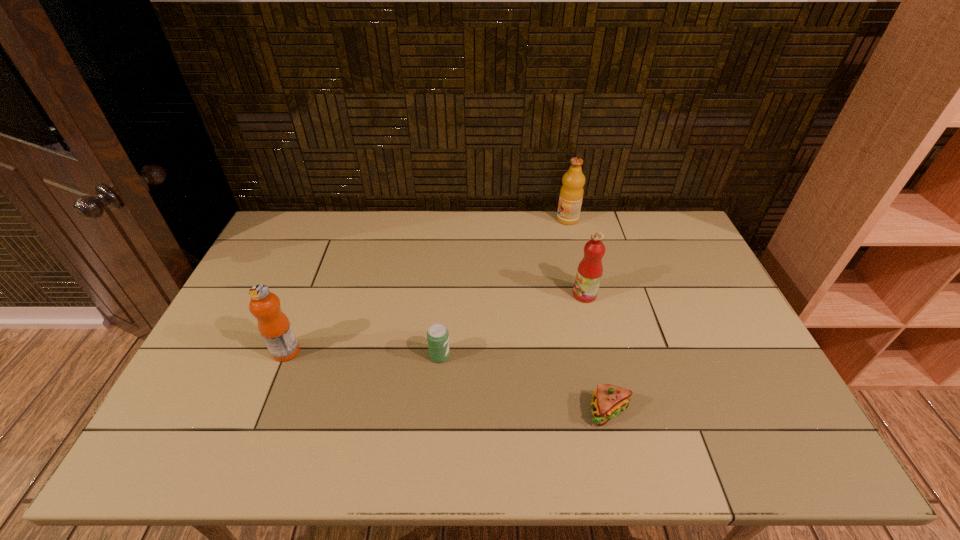
Where is `the farthest fruit juice`? The image size is (960, 540). the farthest fruit juice is located at coordinates (571, 194).

This screenshot has height=540, width=960. I want to click on the nearest fruit juice, so click(x=274, y=326).

The width and height of the screenshot is (960, 540). I want to click on the leftmost fruit juice, so click(x=274, y=326).

The height and width of the screenshot is (540, 960). I want to click on the second farthest object, so click(x=590, y=269).

At what (x,y) coordinates should I click in order to perform the action: click on the second object from left to right. Please return your answer as a coordinate pair (x, y). The height and width of the screenshot is (540, 960). Looking at the image, I should click on (437, 335).

This screenshot has width=960, height=540. I want to click on sandwich, so click(x=609, y=400).

At what (x,y) coordinates should I click in order to perform the action: click on free space located 0.100m on the front label of the farthest fruit juice. Please return your answer as a coordinate pair (x, y). This screenshot has height=540, width=960. Looking at the image, I should click on (530, 219).

What are the coordinates of `vacant area situated 0.340m on the front label of the farthest fruit juice` in the screenshot? It's located at (466, 219).

Image resolution: width=960 pixels, height=540 pixels. In order to click on vacant space located 0.100m on the front label of the farthest fruit juice in this screenshot , I will do pos(530,219).

Where is `vacant region located 0.050m on the right of the nearest fruit juice`? The width and height of the screenshot is (960, 540). vacant region located 0.050m on the right of the nearest fruit juice is located at coordinates [x=318, y=352].